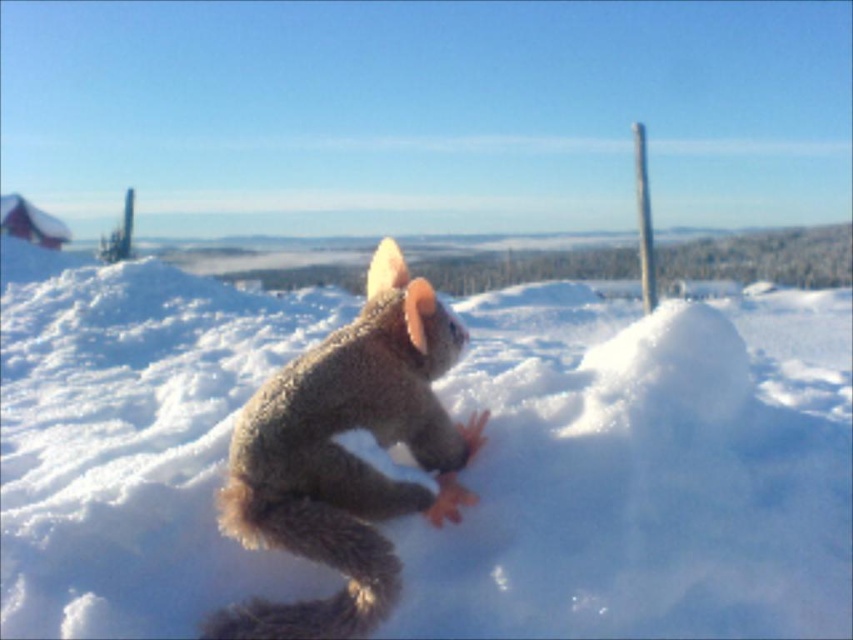
Can you confirm if white fluffy snow at center is positioned to the right of fuzzy brown squirrel at center?

No, white fluffy snow at center is not to the right of fuzzy brown squirrel at center.

Can you confirm if white fluffy snow at center is positioned below fuzzy brown squirrel at center?

Actually, white fluffy snow at center is above fuzzy brown squirrel at center.

Describe the element at coordinates (643, 472) in the screenshot. I see `white fluffy snow at center` at that location.

I want to click on white fluffy snow at center, so click(643, 472).